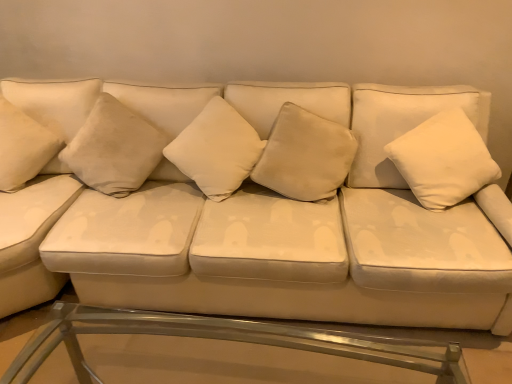
Question: Could you tell me if white velvety pillow at right, which appears as the 5th pillow when viewed from the left, is turned towards suede white couch at center?

Choices:
 (A) no
 (B) yes

Answer: (B)

Question: Is the position of white velvety pillow at right, the first pillow in the right-to-left sequence, less distant than that of suede white couch at center?

Choices:
 (A) no
 (B) yes

Answer: (A)

Question: Considering the relative positions of white velvety pillow at right, the first pillow in the right-to-left sequence, and suede white couch at center in the image provided, is white velvety pillow at right, the first pillow in the right-to-left sequence, to the right of suede white couch at center from the viewer's perspective?

Choices:
 (A) yes
 (B) no

Answer: (A)

Question: Considering the relative sizes of white velvety pillow at right, the first pillow in the right-to-left sequence, and suede white couch at center in the image provided, is white velvety pillow at right, the first pillow in the right-to-left sequence, taller than suede white couch at center?

Choices:
 (A) yes
 (B) no

Answer: (B)

Question: From the image's perspective, is white velvety pillow at right, the first pillow in the right-to-left sequence, located beneath suede white couch at center?

Choices:
 (A) no
 (B) yes

Answer: (A)

Question: Is suede white couch at center at the back of white velvety pillow at right, which appears as the 5th pillow when viewed from the left?

Choices:
 (A) yes
 (B) no

Answer: (A)

Question: Is the surface of white velvety pillow at right, which appears as the 5th pillow when viewed from the left, in direct contact with clear glass table at lower center?

Choices:
 (A) no
 (B) yes

Answer: (A)

Question: Is white velvety pillow at right, the first pillow in the right-to-left sequence, positioned behind clear glass table at lower center?

Choices:
 (A) yes
 (B) no

Answer: (A)

Question: Is white velvety pillow at right, which appears as the 5th pillow when viewed from the left, completely or partially outside of clear glass table at lower center?

Choices:
 (A) no
 (B) yes

Answer: (B)

Question: From a real-world perspective, is white velvety pillow at right, which appears as the 5th pillow when viewed from the left, positioned over clear glass table at lower center based on gravity?

Choices:
 (A) no
 (B) yes

Answer: (B)

Question: Considering the relative sizes of white velvety pillow at right, which appears as the 5th pillow when viewed from the left, and clear glass table at lower center in the image provided, is white velvety pillow at right, which appears as the 5th pillow when viewed from the left, wider than clear glass table at lower center?

Choices:
 (A) no
 (B) yes

Answer: (B)

Question: From the image's perspective, is white velvety pillow at right, which appears as the 5th pillow when viewed from the left, over clear glass table at lower center?

Choices:
 (A) no
 (B) yes

Answer: (B)

Question: Can you confirm if suede-like beige pillow at center, the fourth pillow from the right, is taller than suede white couch at center?

Choices:
 (A) no
 (B) yes

Answer: (A)